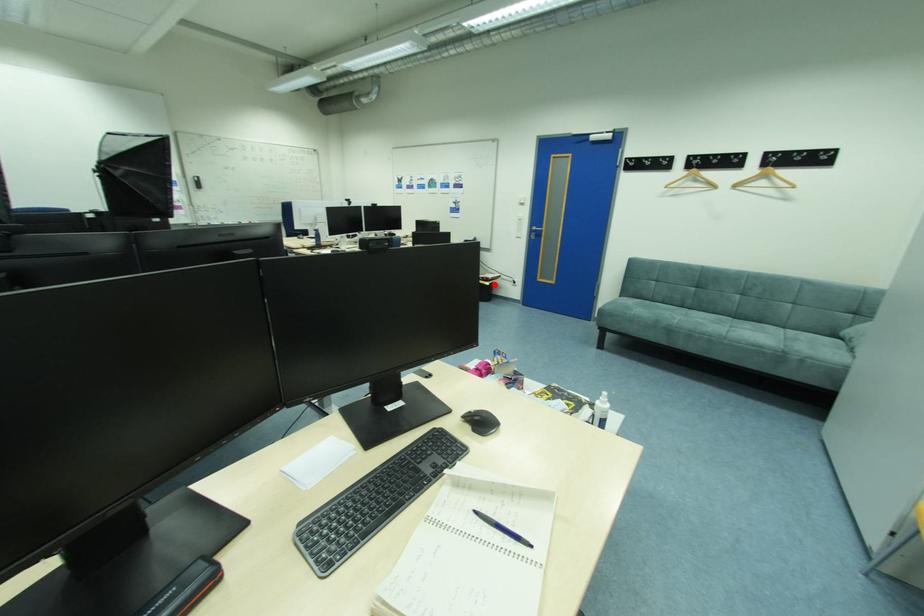
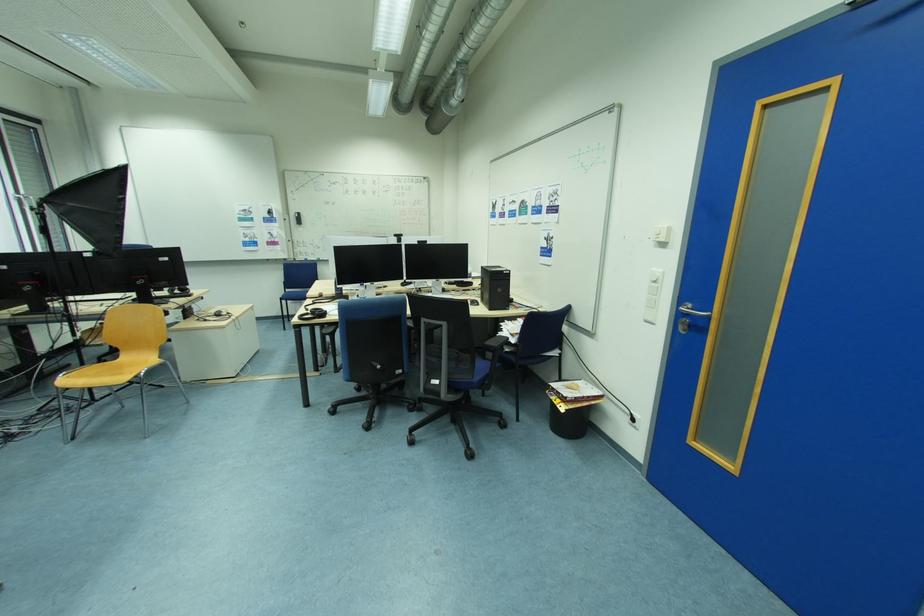
Find the pixel in the second image that matches the highlighted location in the first image.

(569, 408)